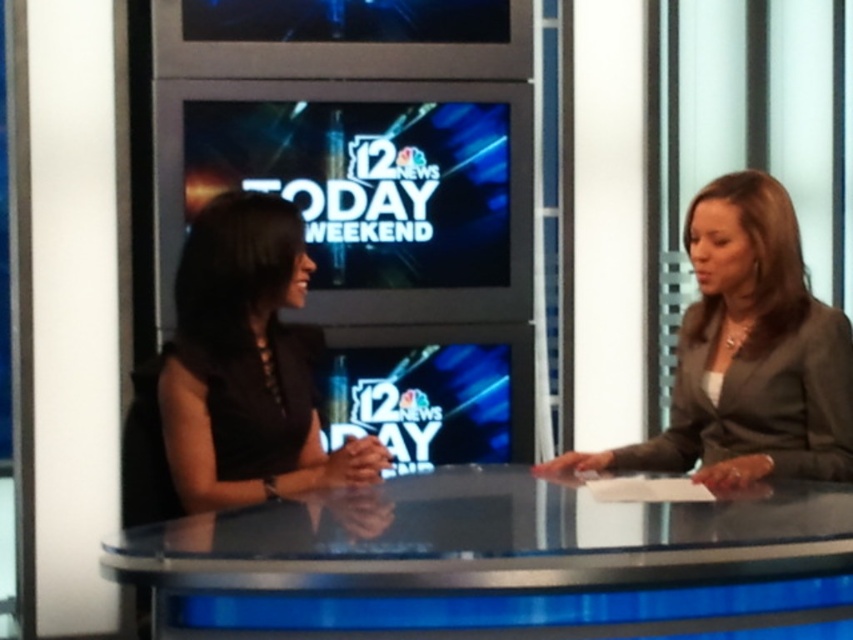
Question: Does transparent glass table at center lie in front of dark gray suit at right?

Choices:
 (A) no
 (B) yes

Answer: (B)

Question: Which point is farther to the camera?

Choices:
 (A) (753, 509)
 (B) (834, 358)

Answer: (B)

Question: Is transparent glass table at center wider than dark gray suit at right?

Choices:
 (A) no
 (B) yes

Answer: (B)

Question: Which object is the closest to the black matte dress at center?

Choices:
 (A) dark gray suit at right
 (B) transparent glass table at center

Answer: (B)

Question: Is dark gray suit at right below black matte dress at center?

Choices:
 (A) no
 (B) yes

Answer: (A)

Question: Which point is farther from the camera taking this photo?

Choices:
 (A) (235, 628)
 (B) (247, 292)
 (C) (698, 365)

Answer: (C)